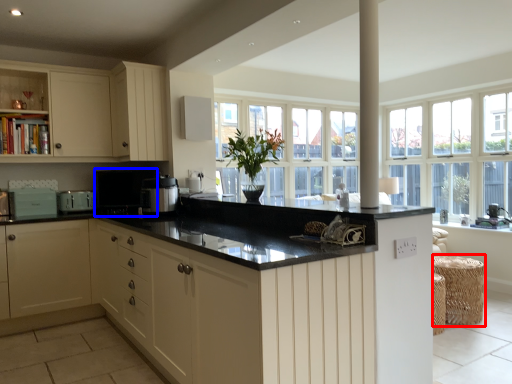
Question: Which object is further to the camera taking this photo, bar stool (highlighted by a red box) or appliance (highlighted by a blue box)?

Choices:
 (A) bar stool
 (B) appliance

Answer: (B)